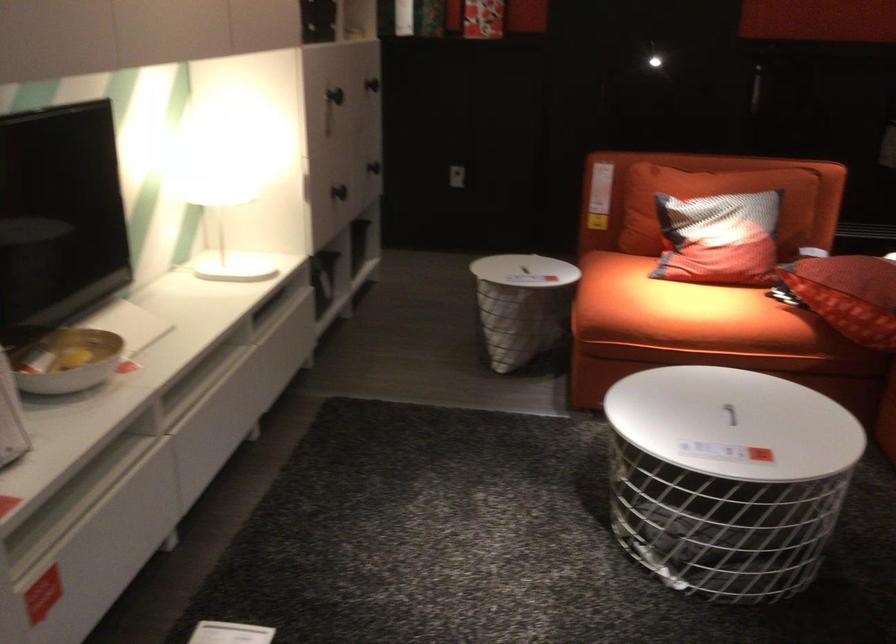
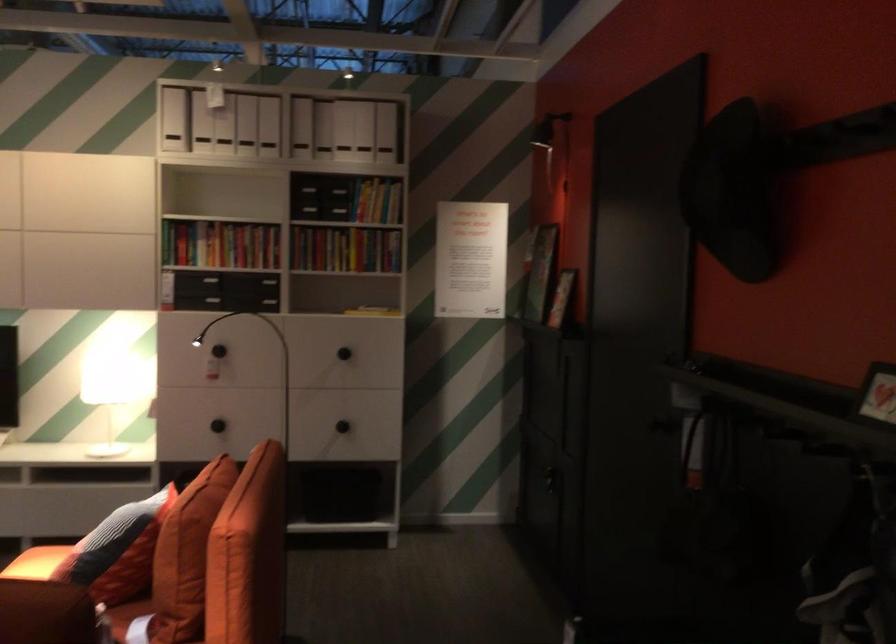
Locate, in the second image, the point that corresponds to (307,174) in the first image.

(108, 391)